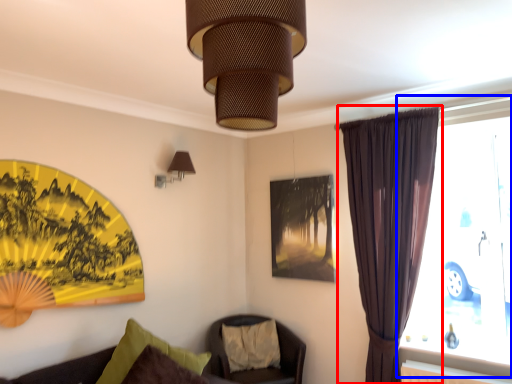
Question: Among these objects, which one is nearest to the camera, curtain (highlighted by a red box) or window (highlighted by a blue box)?

Choices:
 (A) curtain
 (B) window

Answer: (B)